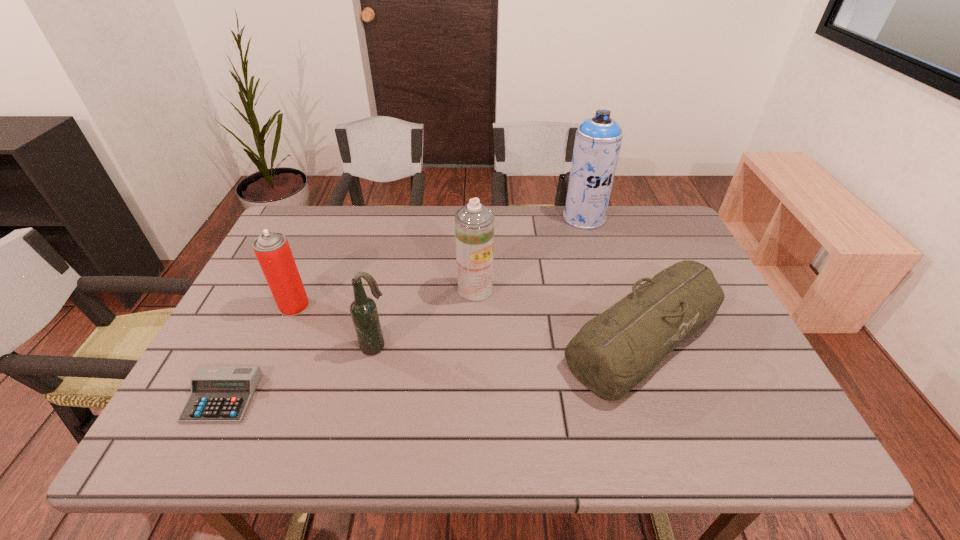
Locate an element on the screen. The height and width of the screenshot is (540, 960). the tallest aerosol can is located at coordinates (598, 139).

The image size is (960, 540). In order to click on the rightmost aerosol can in this screenshot , I will do `click(598, 139)`.

Find the location of a particular element. The width and height of the screenshot is (960, 540). the fourth object from left to right is located at coordinates (474, 223).

The height and width of the screenshot is (540, 960). In order to click on the leftmost aerosol can in this screenshot , I will do `click(272, 249)`.

Locate an element on the screen. This screenshot has width=960, height=540. the fourth object from right to left is located at coordinates (363, 310).

At what (x,y) coordinates should I click in order to perform the action: click on duffel bag. Please return your answer as a coordinate pair (x, y). This screenshot has width=960, height=540. Looking at the image, I should click on (612, 353).

Locate an element on the screen. This screenshot has height=540, width=960. the shortest object is located at coordinates (219, 394).

Locate an element on the screen. The height and width of the screenshot is (540, 960). vacant region located on the front of the tallest aerosol can is located at coordinates (616, 321).

At what (x,y) coordinates should I click in order to perform the action: click on vacant region located 0.100m on the left of the second aerosol can from left to right. Please return your answer as a coordinate pair (x, y). Looking at the image, I should click on (420, 289).

You are a GUI agent. You are given a task and a screenshot of the screen. Output one action in this format:
    pyautogui.click(x=<x>, y=<y>)
    Task: Click on the free spot located 0.060m on the right of the leftmost aerosol can
    This screenshot has height=540, width=960.
    Given the screenshot: What is the action you would take?
    pyautogui.click(x=332, y=306)